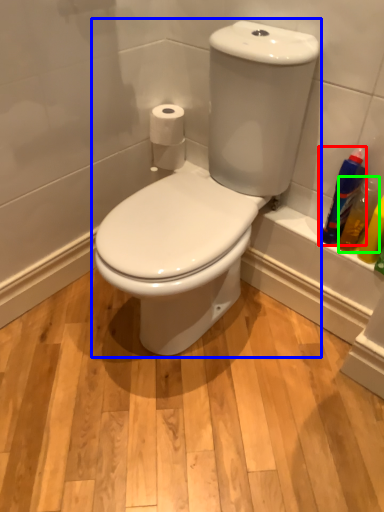
Question: Which is farther away from cleaning product (highlighted by a red box)? toilet (highlighted by a blue box) or cleaning product (highlighted by a green box)?

Choices:
 (A) toilet
 (B) cleaning product

Answer: (A)